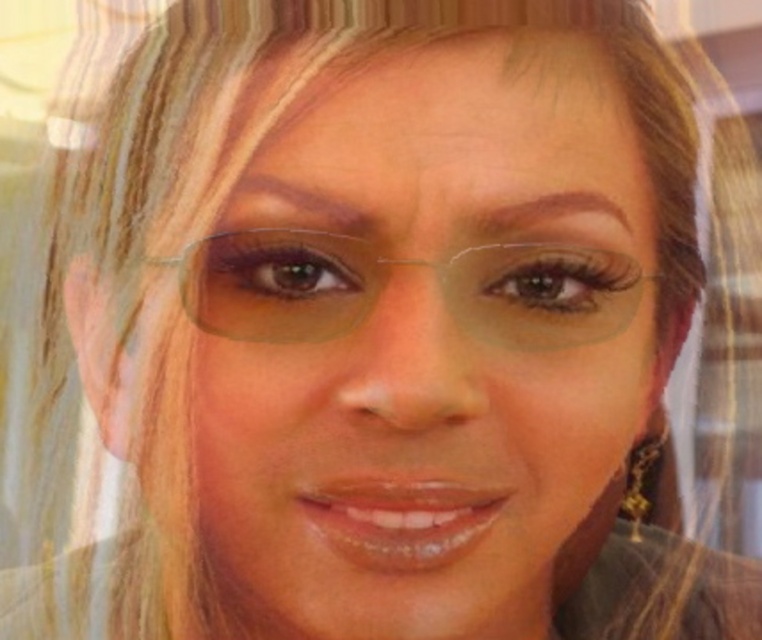
Question: Among these objects, which one is nearest to the camera?

Choices:
 (A) gold metallic earring at lower right
 (B) clear plastic glasses at center

Answer: (B)

Question: Is clear plastic glasses at center above gold metallic earring at lower right?

Choices:
 (A) no
 (B) yes

Answer: (B)

Question: Does clear plastic glasses at center appear on the left side of gold metallic earring at lower right?

Choices:
 (A) yes
 (B) no

Answer: (A)

Question: Which point appears closest to the camera in this image?

Choices:
 (A) (629, 480)
 (B) (317, 241)

Answer: (B)

Question: From the image, what is the correct spatial relationship of clear plastic glasses at center in relation to gold metallic earring at lower right?

Choices:
 (A) right
 (B) left

Answer: (B)